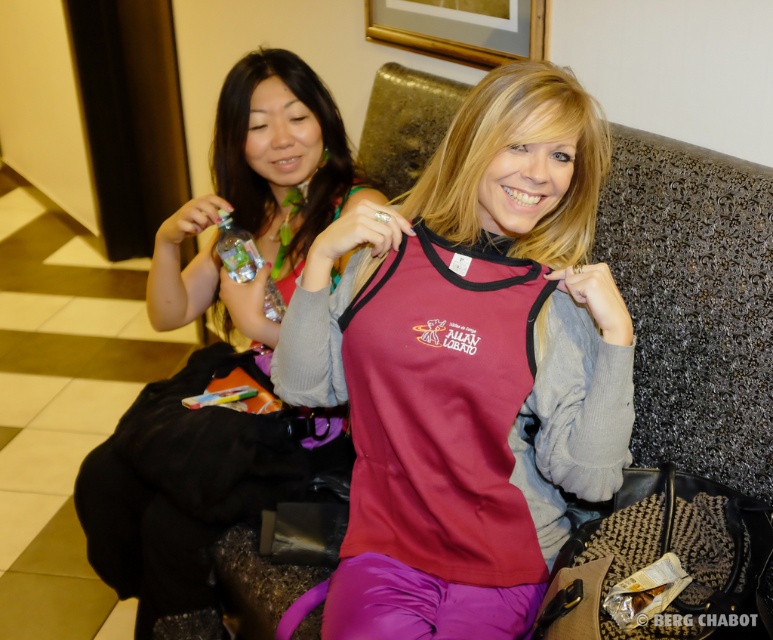
You are designing a storage box that needs to fit either the matte red fabric shirt at center or the clear plastic bottle at upper left. Which object requires a wider storage space?

The matte red fabric shirt at center requires a wider storage space because it might be wider than the clear plastic bottle at upper left.

You are a fashion designer observing two shirts displayed on a mannequin in a store window. The shirts are the matte red fabric shirt at center and the matte black shirt at left. Which shirt is narrower in width?

The matte red fabric shirt at center has a lesser width compared to the matte black shirt at left, so the matte red fabric shirt at center is narrower.